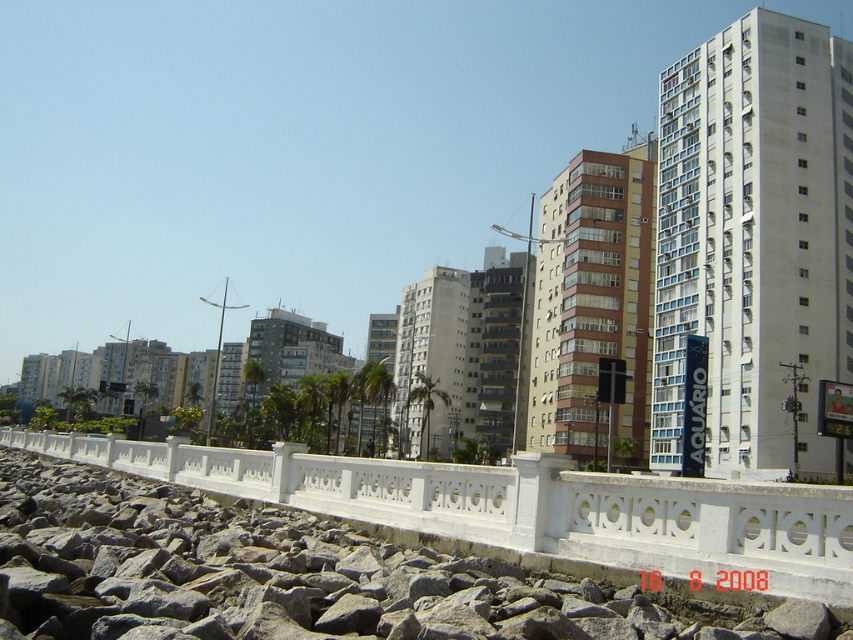
You are a city planner reviewing this waterfront area. You need to determine if the white stone fence at center can be replaced with a new, wider decorative fence without encroaching on the white concrete building at center. Based on the current spatial relationship, is this feasible?

The white stone fence at center might be wider than white concrete building at center, so replacing it with a wider decorative fence could potentially encroach on the building. Further measurements are needed to confirm.

You are a city planner assessing the urban waterfront area. You need to determine if the white stone fence at center can be seen from the top of the white concrete building at center. Based on their heights, can the fence be visible from there?

The white stone fence at center has a lesser height compared to the white concrete building at center, so the fence would be visible from the top of the building since it is shorter and located in the foreground.